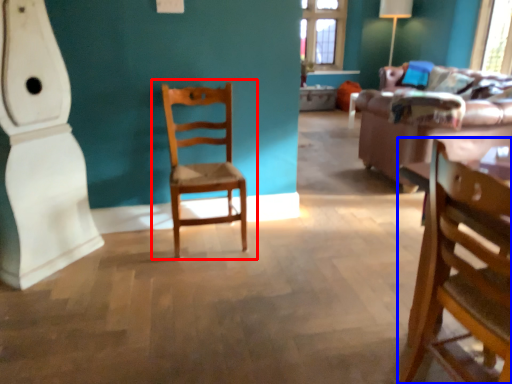
Question: Which object appears closest to the camera in this image, chair (highlighted by a red box) or chair (highlighted by a blue box)?

Choices:
 (A) chair
 (B) chair

Answer: (B)